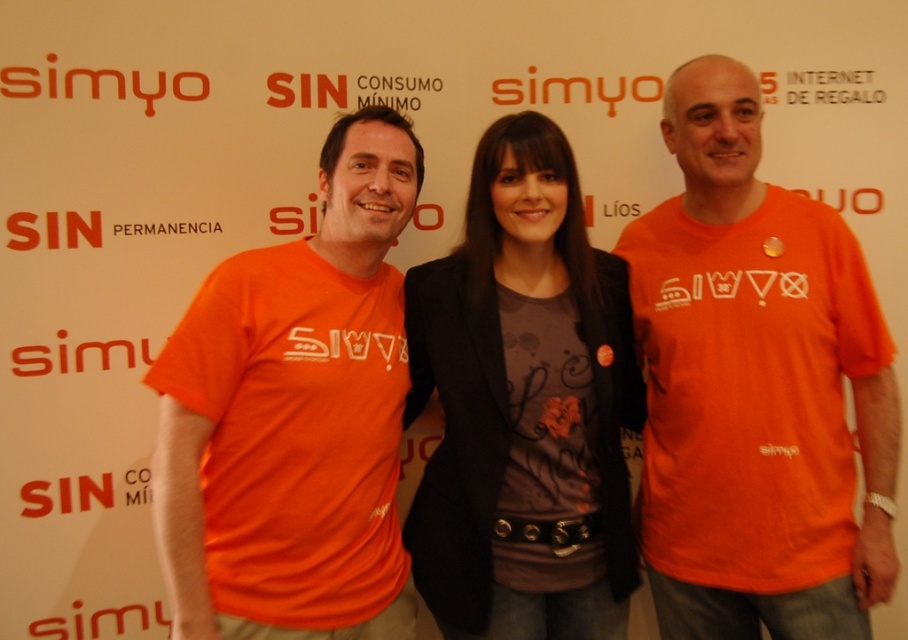
What is the color of the tshirt at point [756,388]?

The orange matte tshirt at center is located at point [756,388], so the color is orange.